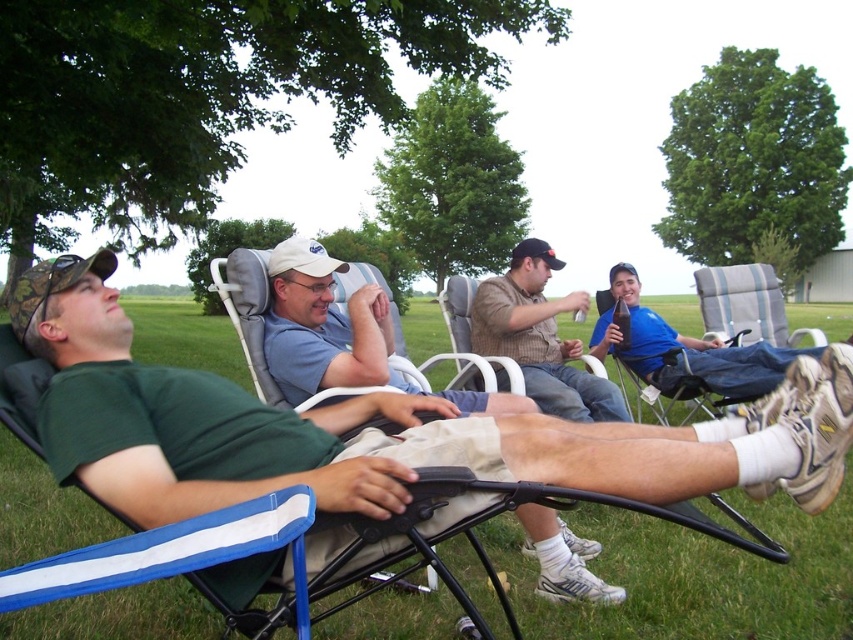
Question: Which is nearer to the striped fabric beach chair at right?

Choices:
 (A) light blue fabric chair at center
 (B) green fabric chair at left
 (C) brown woven shirt at center

Answer: (C)

Question: Can you confirm if light blue fabric chair at center is positioned above brown woven shirt at center?

Choices:
 (A) no
 (B) yes

Answer: (A)

Question: Is brown woven shirt at center bigger than striped fabric beach chair at right?

Choices:
 (A) yes
 (B) no

Answer: (A)

Question: Is the position of green fabric chair at left more distant than that of light blue fabric chair at center?

Choices:
 (A) yes
 (B) no

Answer: (B)

Question: Which is nearer to the striped fabric beach chair at right?

Choices:
 (A) brown woven shirt at center
 (B) light blue fabric chair at center
 (C) green fabric chair at left

Answer: (A)

Question: Which of the following is the closest to the observer?

Choices:
 (A) brown woven shirt at center
 (B) light blue fabric chair at center
 (C) green fabric chair at left

Answer: (C)